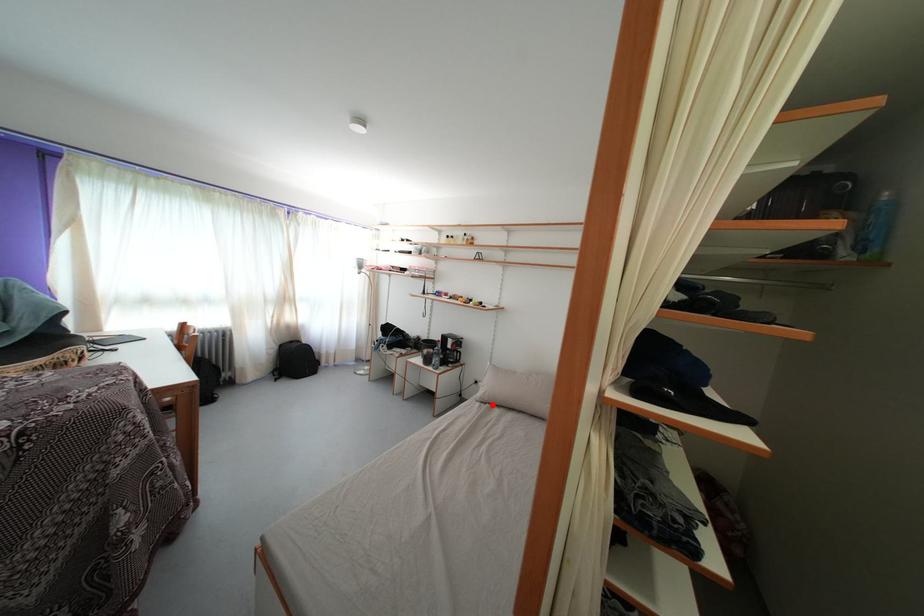
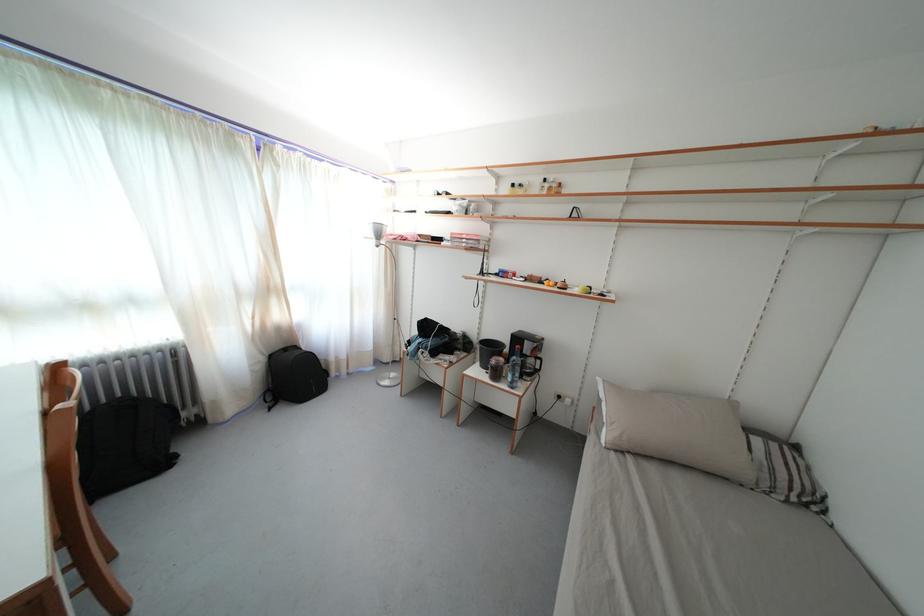
The point at the highlighted location is marked in the first image. Where is the corresponding point in the second image?

(630, 452)